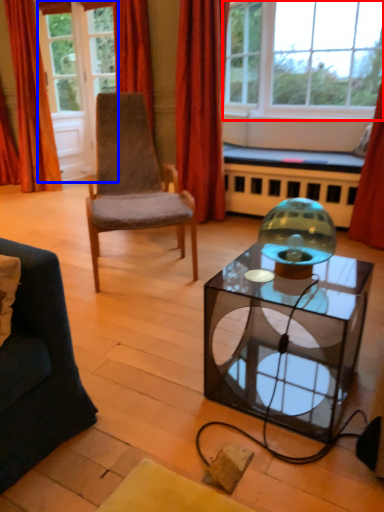
Question: Which object is further to the camera taking this photo, window (highlighted by a red box) or glass door (highlighted by a blue box)?

Choices:
 (A) window
 (B) glass door

Answer: (B)